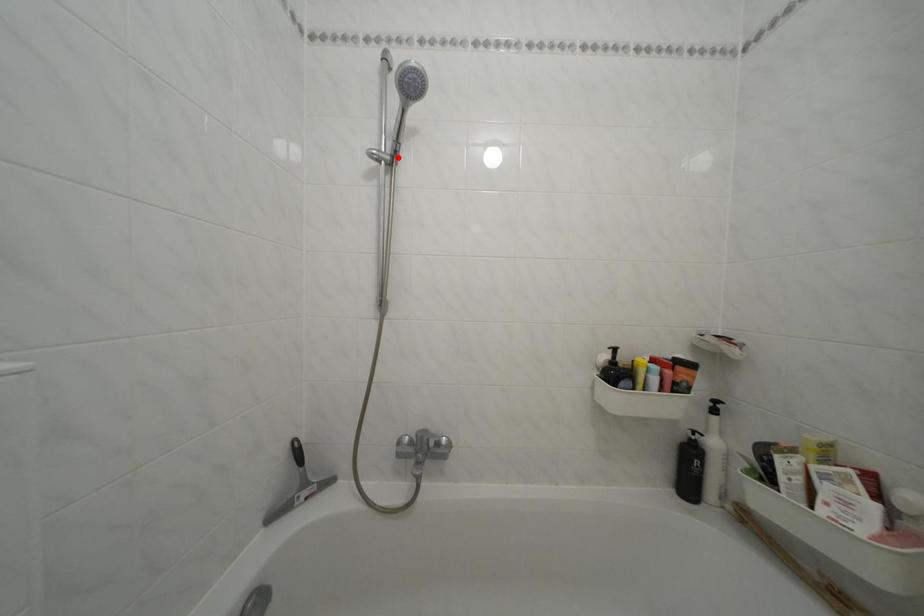
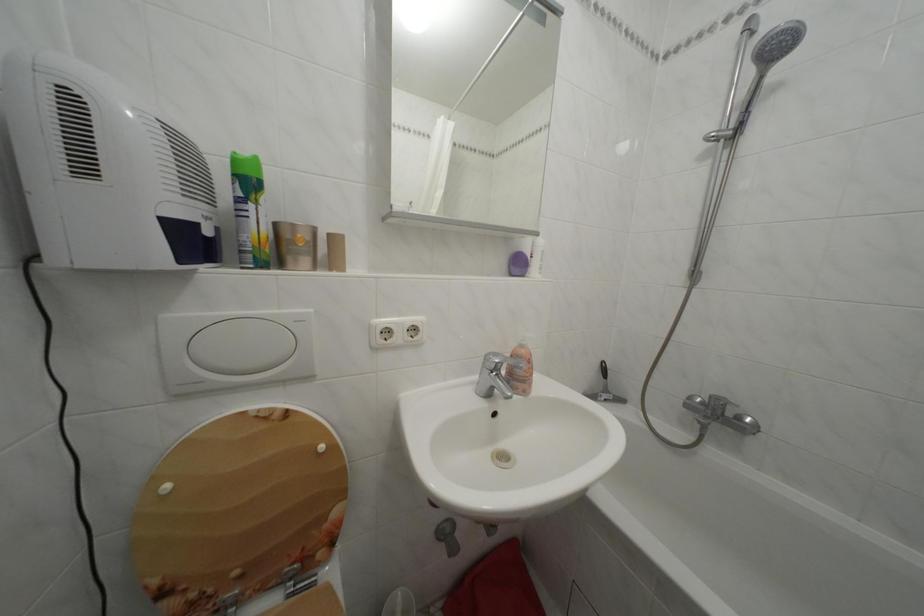
In the second image, find the point that corresponds to the highlighted location in the first image.

(742, 132)